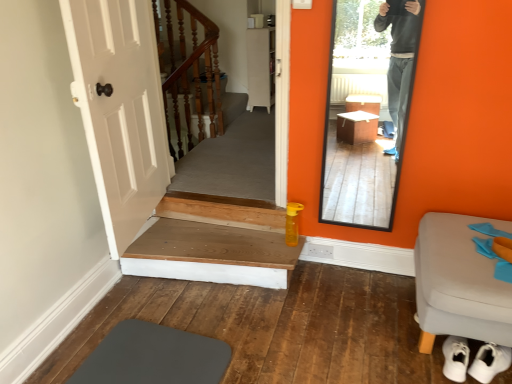
Locate an element on the screen. This screenshot has width=512, height=384. free point above wooden at bottom, placed as the 1th stairs when sorted from bottom to top (from a real-world perspective) is located at coordinates click(x=204, y=244).